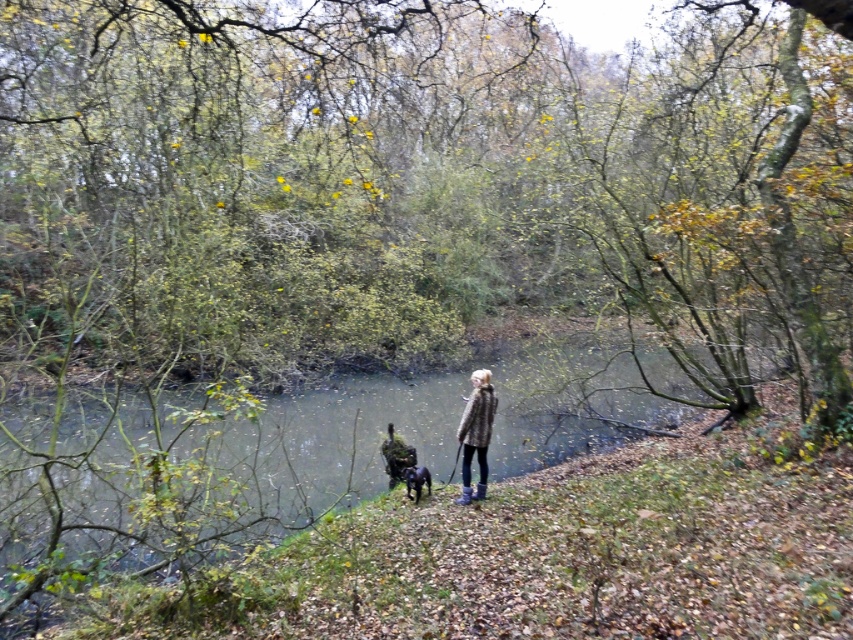
Which is below, clear water at center or fuzzy gray coat at center?

Positioned lower is clear water at center.

Measure the distance from clear water at center to fuzzy gray coat at center.

clear water at center is 6.85 meters away from fuzzy gray coat at center.

Locate an element on the screen. Image resolution: width=853 pixels, height=640 pixels. clear water at center is located at coordinates (201, 474).

Is clear water at center below shiny black dog at center?

No.

Is point (103, 540) positioned after point (409, 492)?

That is False.

The width and height of the screenshot is (853, 640). Identify the location of clear water at center. (201, 474).

Between point (469, 481) and point (419, 480), which one is positioned behind?

Point (419, 480)

Is fuzzy gray coat at center thinner than shiny black dog at center?

Incorrect, fuzzy gray coat at center's width is not less than shiny black dog at center's.

The width and height of the screenshot is (853, 640). In order to click on fuzzy gray coat at center in this screenshot , I will do `click(476, 433)`.

The image size is (853, 640). What are the coordinates of `fuzzy gray coat at center` in the screenshot? It's located at (476, 433).